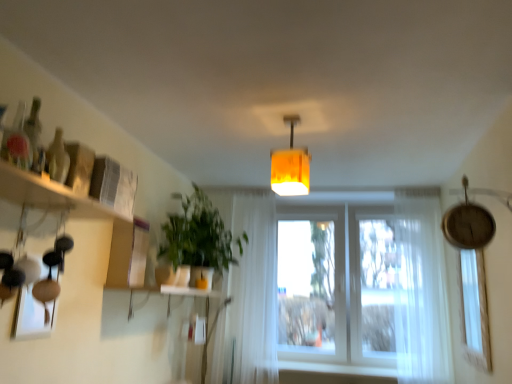
Question: Could you tell me if translucent glass bottle at upper left is facing white sheer curtain at right, the 1th curtain when ordered from right to left?

Choices:
 (A) no
 (B) yes

Answer: (A)

Question: Would you say white sheer curtain at right, the 1th curtain when ordered from right to left, is part of translucent glass bottle at upper left's contents?

Choices:
 (A) no
 (B) yes

Answer: (A)

Question: Can we say translucent glass bottle at upper left lies outside white sheer curtain at right, the 1th curtain when ordered from right to left?

Choices:
 (A) yes
 (B) no

Answer: (A)

Question: Does translucent glass bottle at upper left have a greater width compared to white sheer curtain at right, the 1th curtain when ordered from right to left?

Choices:
 (A) no
 (B) yes

Answer: (A)

Question: Considering the relative positions of translucent glass bottle at upper left and white sheer curtain at right, the 1th curtain when ordered from right to left, in the image provided, is translucent glass bottle at upper left to the right of white sheer curtain at right, the 1th curtain when ordered from right to left, from the viewer's perspective?

Choices:
 (A) yes
 (B) no

Answer: (B)

Question: From a real-world perspective, relative to white matte window sill at lower center, is white sheer curtain at center, which is counted as the 1th curtain, starting from the left, vertically above or below?

Choices:
 (A) below
 (B) above

Answer: (B)

Question: Is white sheer curtain at center, which is counted as the 1th curtain, starting from the left, inside the boundaries of white matte window sill at lower center, or outside?

Choices:
 (A) outside
 (B) inside

Answer: (A)

Question: In the image, is white sheer curtain at center, which is counted as the 1th curtain, starting from the left, positioned in front of or behind white matte window sill at lower center?

Choices:
 (A) front
 (B) behind

Answer: (B)

Question: Considering the positions of white sheer curtain at center, which appears as the second curtain when viewed from the right, and white matte window sill at lower center in the image, is white sheer curtain at center, which appears as the second curtain when viewed from the right, wider or thinner than white matte window sill at lower center?

Choices:
 (A) thin
 (B) wide

Answer: (A)

Question: Is white matte window sill at lower center in front of or behind green matte plant at center-left in the image?

Choices:
 (A) front
 (B) behind

Answer: (B)

Question: From a real-world perspective, is white matte window sill at lower center physically located above or below green matte plant at center-left?

Choices:
 (A) below
 (B) above

Answer: (A)

Question: Is white matte window sill at lower center taller or shorter than green matte plant at center-left?

Choices:
 (A) short
 (B) tall

Answer: (A)

Question: Considering the positions of white matte window sill at lower center and green matte plant at center-left in the image, is white matte window sill at lower center wider or thinner than green matte plant at center-left?

Choices:
 (A) wide
 (B) thin

Answer: (B)

Question: Considering the positions of translucent glass bottle at upper left and white sheer curtain at center, which appears as the second curtain when viewed from the right, in the image, is translucent glass bottle at upper left taller or shorter than white sheer curtain at center, which appears as the second curtain when viewed from the right,?

Choices:
 (A) tall
 (B) short

Answer: (B)

Question: Does point [55, 140] appear closer or farther from the camera than point [239, 284]?

Choices:
 (A) farther
 (B) closer

Answer: (B)